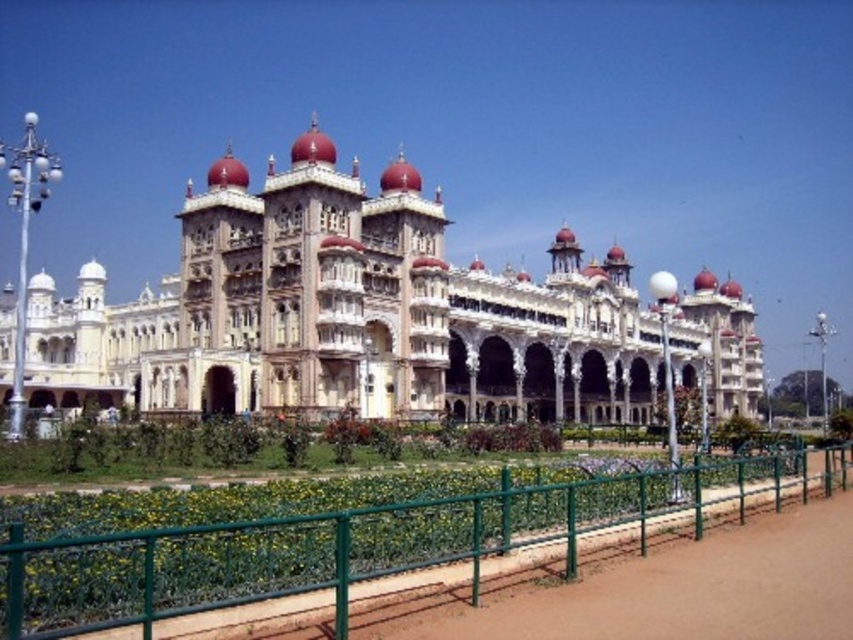
How far apart are white stone palace at center and green metal fence at lower center?

white stone palace at center is 48.26 meters away from green metal fence at lower center.

Between point (308, 294) and point (300, 524), which one is positioned behind?

Point (308, 294)

Who is more forward, (277, 236) or (169, 605)?

Point (169, 605) is in front.

The width and height of the screenshot is (853, 640). In order to click on white stone palace at center in this screenshot , I will do `click(338, 314)`.